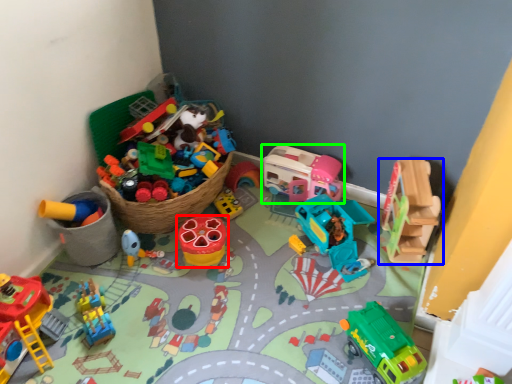
Question: Which object is the farthest from toy (highlighted by a red box)? Choose among these: toy (highlighted by a blue box) or toy (highlighted by a green box).

Choices:
 (A) toy
 (B) toy

Answer: (A)